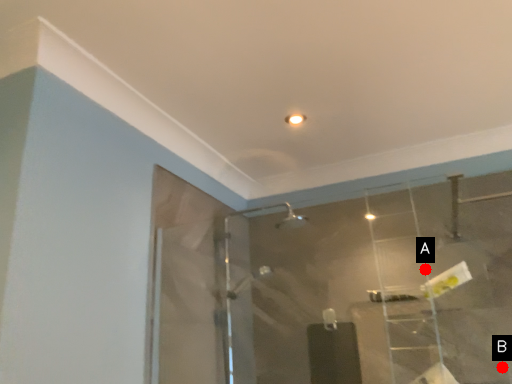
Question: Two points are circled on the image, labeled by A and B beside each circle. Which of the following is the closest to the observer?

Choices:
 (A) A is closer
 (B) B is closer

Answer: (B)